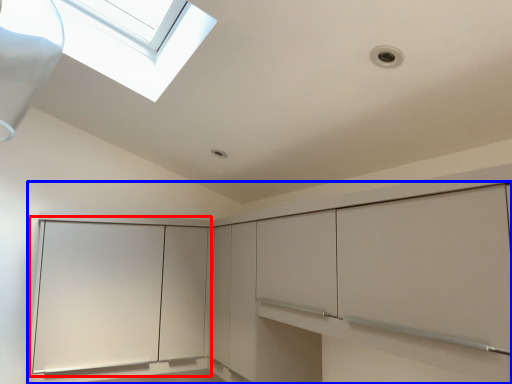
Question: Among these objects, which one is farthest to the camera, glass door (highlighted by a red box) or cabinetry (highlighted by a blue box)?

Choices:
 (A) glass door
 (B) cabinetry

Answer: (A)